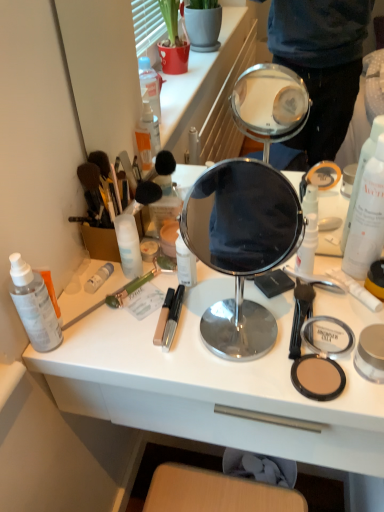
Where is `vacant space to the left of white matte spray bottle at right`? The image size is (384, 512). vacant space to the left of white matte spray bottle at right is located at coordinates (273, 296).